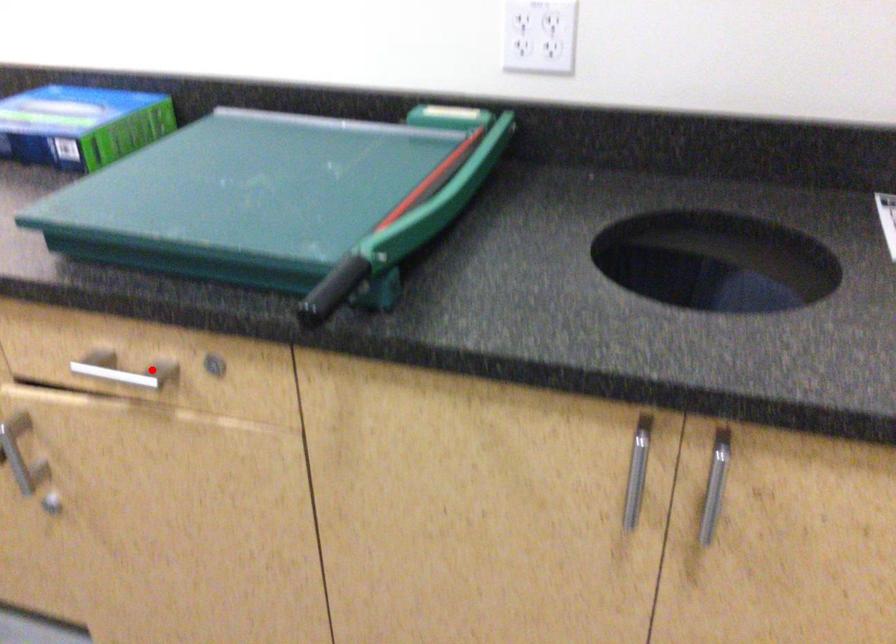
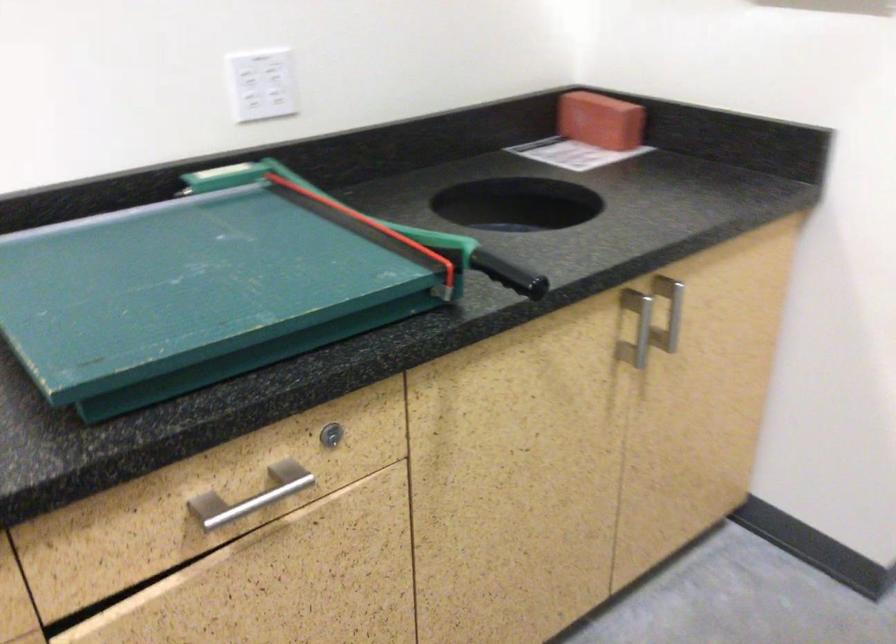
Question: A red point is marked in image1. In image2, is the corresponding 3D point closer to the camera or farther? Reply with the corresponding letter.

Choices:
 (A) The corresponding 3D point is closer.
 (B) The corresponding 3D point is farther.

Answer: (A)